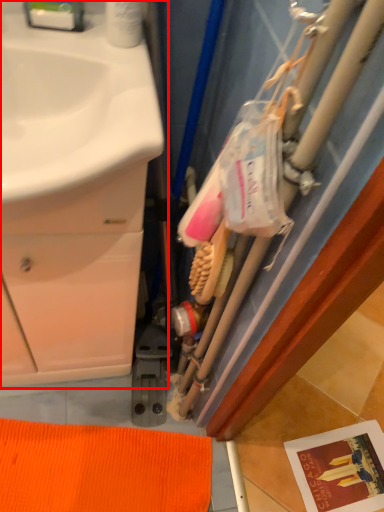
Question: From the image's perspective, what is the correct spatial positioning of bathroom cabinet (annotated by the red box) in reference to brush?

Choices:
 (A) below
 (B) above

Answer: (B)